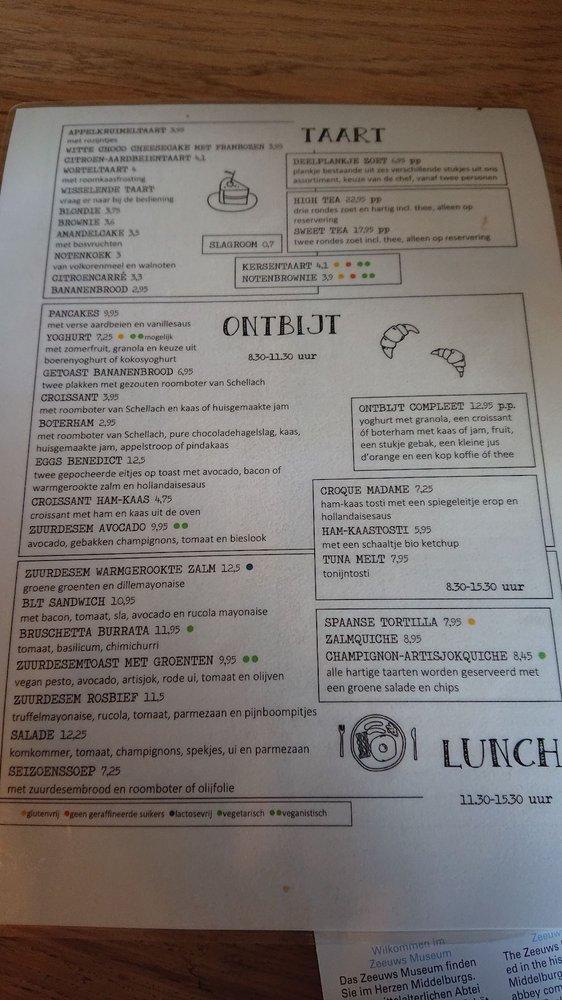
At what (x,y) coordinates should I click in order to perform the action: click on picture. Please return your answer as a coordinate pair (x, y). This screenshot has height=1000, width=562. Looking at the image, I should click on (373, 761).